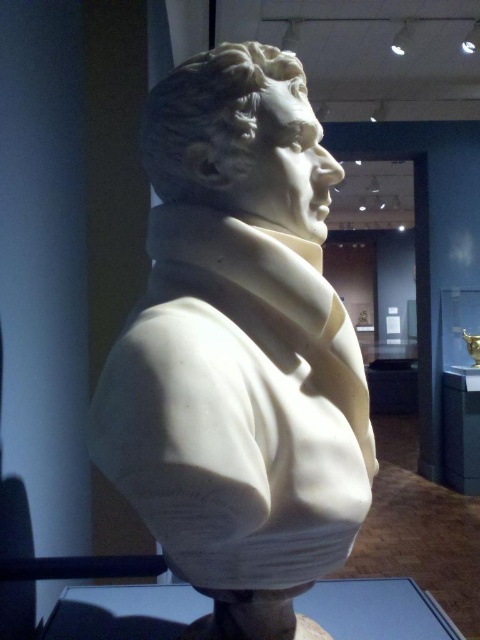
You are an art student standing in front of a museum display. You need to sketch the white marble bust at center. Since you want to capture its position accurately, where would you place it on your paper if your paper uses a coordinate system where the bottom left corner is the origin and the top right corner is the maximum coordinate?

The white marble bust at center is located at coordinates approximately 0.547 on the horizontal axis and 0.498 on the vertical axis, so you should place it at those coordinates on your paper to accurately represent its position.

You are an art conservator tasked with moving the white marble bust at center and the transparent glass table at lower center to a new exhibition space. The entrance to the new space has a narrow doorway that only allows items up to 40 cm in width. Which of the two items can safely pass through the doorway without requiring any adjustments?

The white marble bust at center is thinner than the transparent glass table at lower center. Since the doorway allows items up to 40 cm in width, the white marble bust at center can safely pass through the doorway without adjustments, but the transparent glass table at lower center may be too wide.